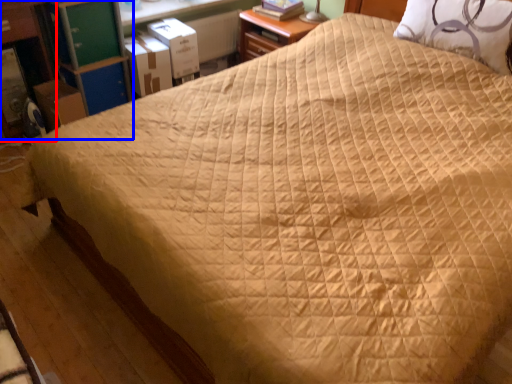
Question: Which point is closer to the camera, dresser (highlighted by a red box) or dresser (highlighted by a blue box)?

Choices:
 (A) dresser
 (B) dresser

Answer: (A)